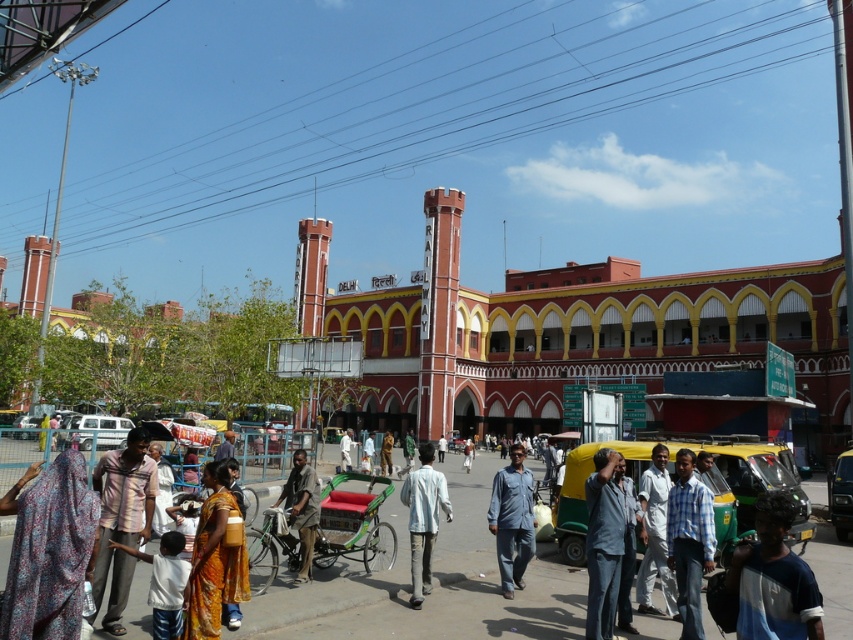
You are a photographer standing in the bustling scene outside the Delhi Railway station. You notice a person wearing a light blue shirt at center. Where exactly would you aim your camera to capture the point at coordinates (345, 449) on the light blue shirt at center?

The point at coordinates (345, 449) is located on the light blue shirt at center, so you should aim your camera directly at the light blue shirt at center to capture that specific point.

You are a photographer standing in front of the Delhi Railway station. You notice a person wearing a light blue shirt at center and another person holding a light brown fabric at center. Which of these two is taller?

The light blue shirt at center is much taller than the light brown fabric at center.